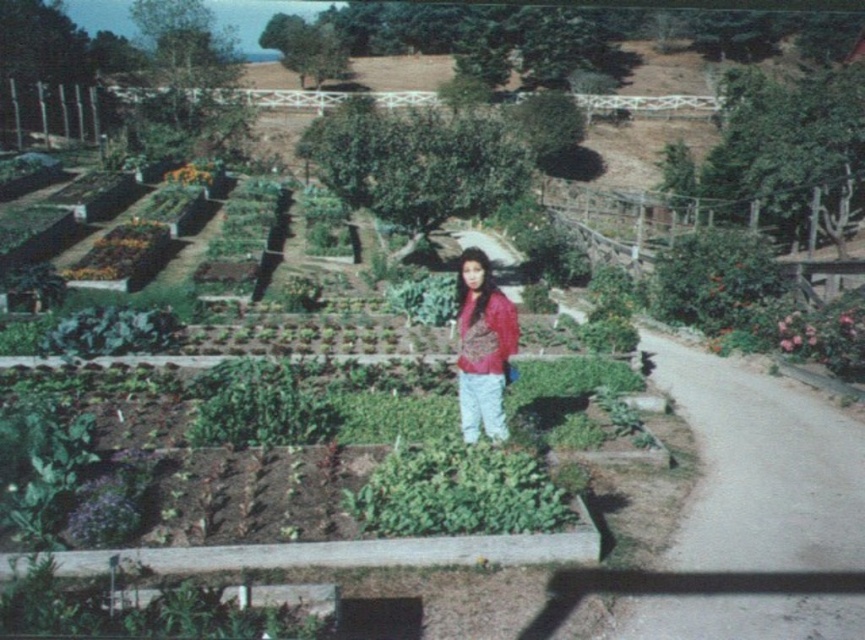
Which is above, green leafy plant at center or matte pink blouse at center?

Positioned higher is matte pink blouse at center.

Who is positioned more to the left, green leafy plant at center or matte pink blouse at center?

matte pink blouse at center

Is point (453, 508) positioned after point (468, 353)?

No, (453, 508) is in front of (468, 353).

At what (x,y) coordinates should I click in order to perform the action: click on green leafy plant at center. Please return your answer as a coordinate pair (x, y). Image resolution: width=865 pixels, height=640 pixels. Looking at the image, I should click on click(x=457, y=492).